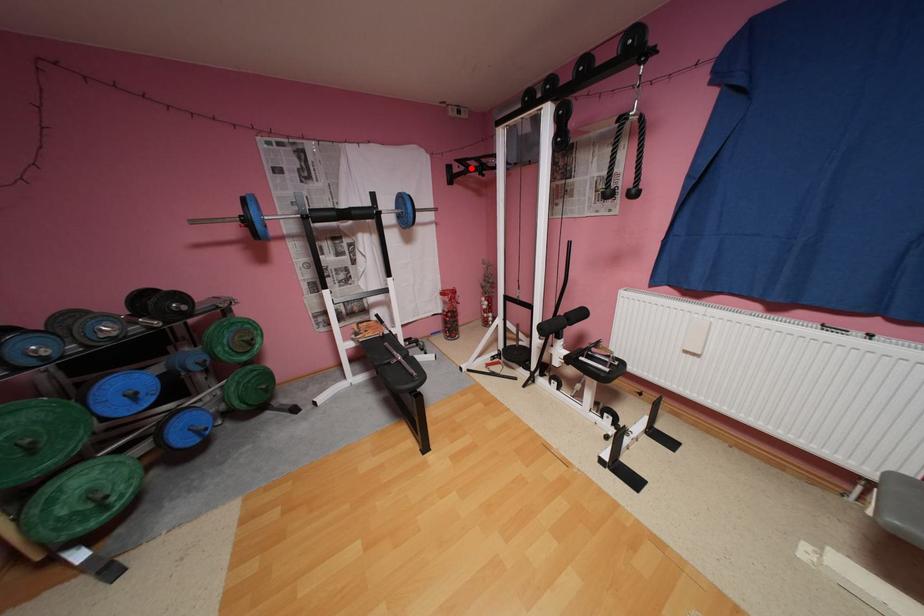
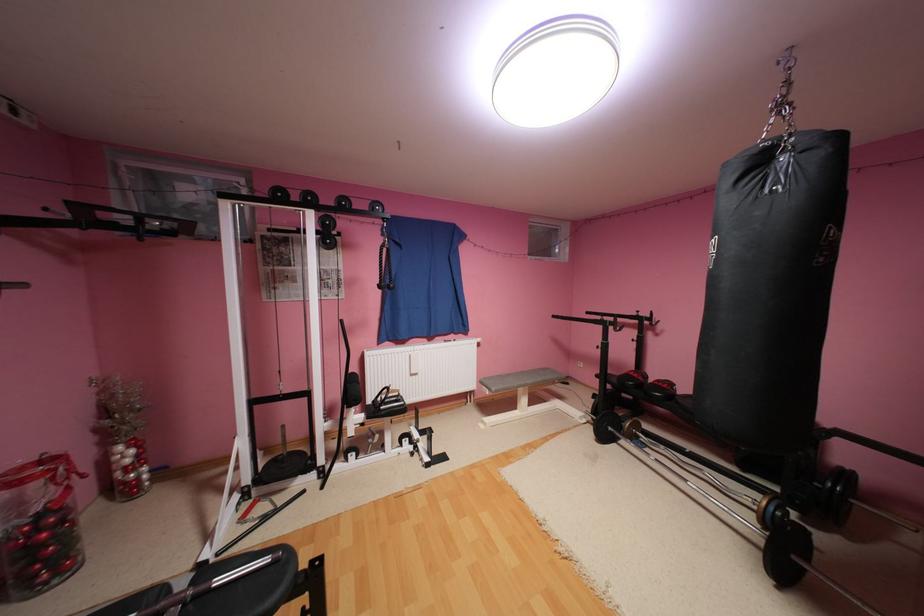
The point at the highlighted location is marked in the first image. Where is the corresponding point in the second image?

(78, 216)